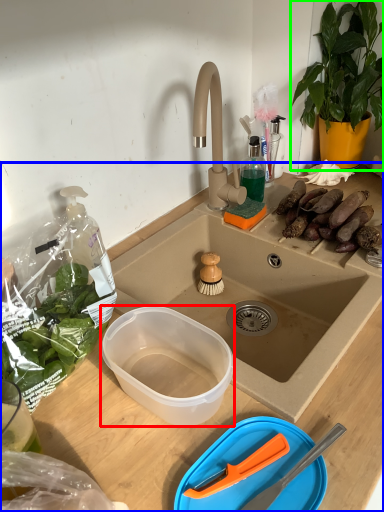
Question: Which object is the closest to the bowl (highlighted by a red box)? Choose among these: desk (highlighted by a blue box) or houseplant (highlighted by a green box).

Choices:
 (A) desk
 (B) houseplant

Answer: (A)